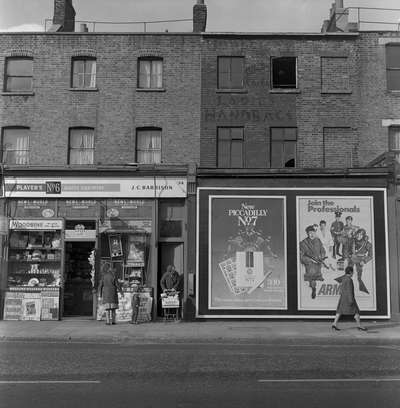
Find the location of a particular element. Image resolution: width=400 pixels, height=408 pixels. window that looks to have no window because of it being so dark is located at coordinates (283, 71).